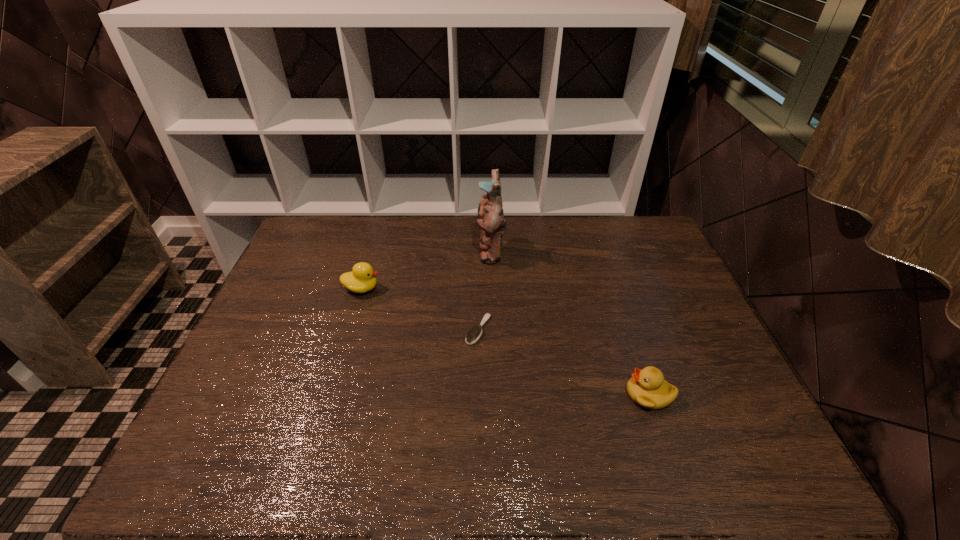
Identify the location of free space located 0.070m on the front-facing side of the tallest object. (457, 252).

Where is `vacant space situated 0.160m on the beak of the leftmost object`? The image size is (960, 540). vacant space situated 0.160m on the beak of the leftmost object is located at coordinates (432, 288).

What are the coordinates of `vacant point located 0.210m on the front-facing side of the nearer duckling` in the screenshot? It's located at (540, 394).

Locate an element on the screen. This screenshot has width=960, height=540. vacant area located 0.340m on the front-facing side of the nearer duckling is located at coordinates (488, 394).

The image size is (960, 540). Identify the location of vacant space located 0.250m on the front-facing side of the nearer duckling. tap(524, 394).

This screenshot has width=960, height=540. In order to click on vacant point located 0.120m on the front of the second nearest object in this screenshot , I will do `click(478, 383)`.

Locate an element on the screen. The width and height of the screenshot is (960, 540). object that is at the far edge is located at coordinates (490, 218).

In the image, there is a desktop. Where is `vacant space at the far edge`? The height and width of the screenshot is (540, 960). vacant space at the far edge is located at coordinates (439, 221).

This screenshot has width=960, height=540. I want to click on vacant area at the near edge of the desktop, so click(400, 477).

You are a GUI agent. You are given a task and a screenshot of the screen. Output one action in this format:
    pyautogui.click(x=<x>, y=<y>)
    Task: Click on the free space at the left edge of the desktop
    The width and height of the screenshot is (960, 540).
    Given the screenshot: What is the action you would take?
    pyautogui.click(x=228, y=386)